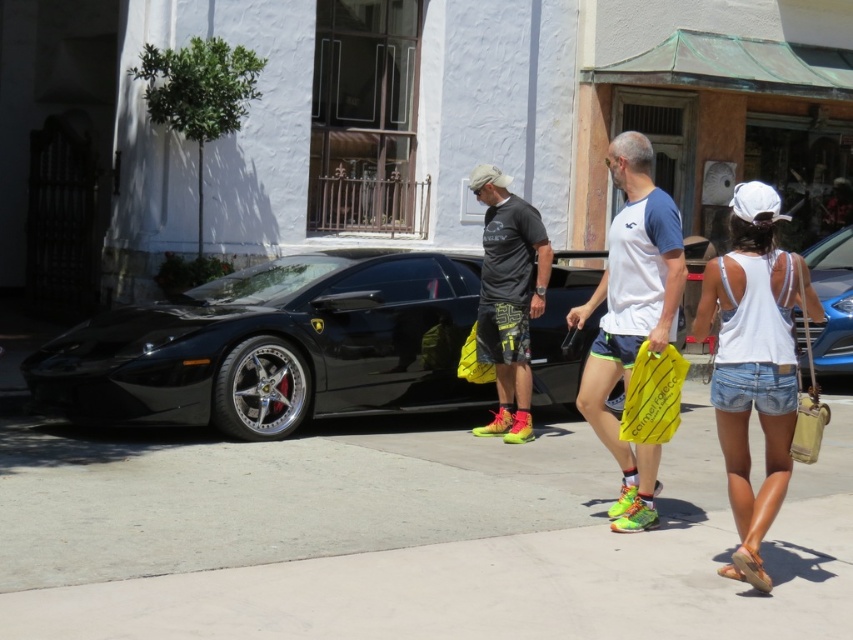
Based on the photo, you are a photographer trying to capture the white cotton tank top at center and the white fabric shirt at center in a clear photo. Which clothing item should you focus on first to ensure it appears sharp in the photo?

The white cotton tank top at center should be focused on first since it is in front of the white fabric shirt at center, ensuring it stays sharp while the background item may blur slightly.